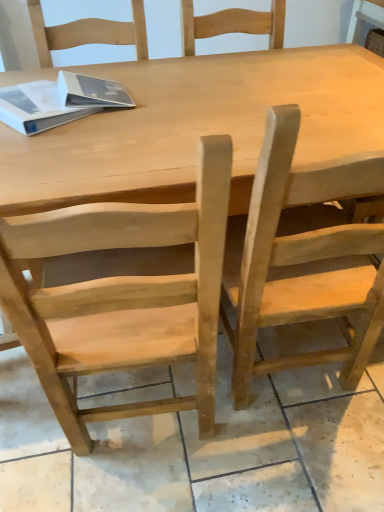
Question: Considering the relative sizes of natural wood table at center and natural wood chair at right, which ranks as the 1th chair in right-to-left order, in the image provided, is natural wood table at center shorter than natural wood chair at right, which ranks as the 1th chair in right-to-left order,?

Choices:
 (A) no
 (B) yes

Answer: (B)

Question: Is natural wood chair at right, marked as the 2th chair in a left-to-right arrangement, at the back of natural wood table at center?

Choices:
 (A) yes
 (B) no

Answer: (A)

Question: From a real-world perspective, is natural wood table at center positioned under natural wood chair at right, which ranks as the 1th chair in right-to-left order, based on gravity?

Choices:
 (A) yes
 (B) no

Answer: (A)

Question: Would you say natural wood table at center is outside natural wood chair at right, marked as the 2th chair in a left-to-right arrangement?

Choices:
 (A) no
 (B) yes

Answer: (B)

Question: Can you confirm if natural wood table at center is taller than natural wood chair at right, which ranks as the 1th chair in right-to-left order?

Choices:
 (A) no
 (B) yes

Answer: (A)

Question: From the image's perspective, relative to white matte book at upper left, is natural wood chair at right, marked as the 2th chair in a left-to-right arrangement, above or below?

Choices:
 (A) above
 (B) below

Answer: (B)

Question: In the image, is natural wood chair at right, marked as the 2th chair in a left-to-right arrangement, on the left side or the right side of white matte book at upper left?

Choices:
 (A) right
 (B) left

Answer: (A)

Question: Is natural wood chair at right, marked as the 2th chair in a left-to-right arrangement, inside the boundaries of white matte book at upper left, or outside?

Choices:
 (A) outside
 (B) inside

Answer: (A)

Question: Considering their positions, is natural wood chair at right, marked as the 2th chair in a left-to-right arrangement, located in front of or behind white matte book at upper left?

Choices:
 (A) front
 (B) behind

Answer: (A)

Question: Is point [61, 424] positioned closer to the camera than point [350, 248]?

Choices:
 (A) closer
 (B) farther

Answer: (B)

Question: From the image's perspective, is natural wood chair at center, the first chair when ordered from left to right, positioned above or below natural wood chair at right, which ranks as the 1th chair in right-to-left order?

Choices:
 (A) below
 (B) above

Answer: (A)

Question: From a real-world perspective, is natural wood chair at center, which ranks as the second chair in right-to-left order, positioned above or below natural wood chair at right, which ranks as the 1th chair in right-to-left order?

Choices:
 (A) below
 (B) above

Answer: (A)

Question: Looking at their shapes, would you say natural wood chair at center, the first chair when ordered from left to right, is wider or thinner than natural wood chair at right, which ranks as the 1th chair in right-to-left order?

Choices:
 (A) wide
 (B) thin

Answer: (A)

Question: From the image's perspective, is natural wood chair at right, which ranks as the 1th chair in right-to-left order, positioned above or below natural wood table at center?

Choices:
 (A) above
 (B) below

Answer: (B)

Question: In the image, is natural wood chair at right, which ranks as the 1th chair in right-to-left order, positioned in front of or behind natural wood table at center?

Choices:
 (A) front
 (B) behind

Answer: (A)